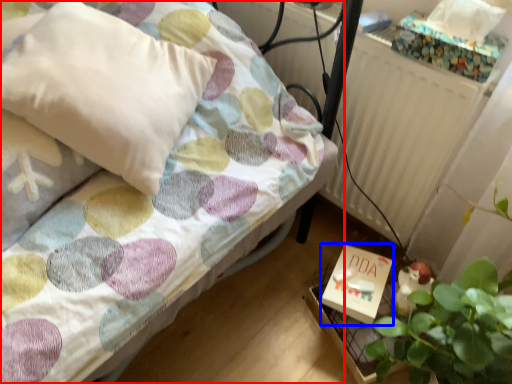
Question: Which object is closer to the camera taking this photo, bed (highlighted by a red box) or box (highlighted by a blue box)?

Choices:
 (A) bed
 (B) box

Answer: (A)